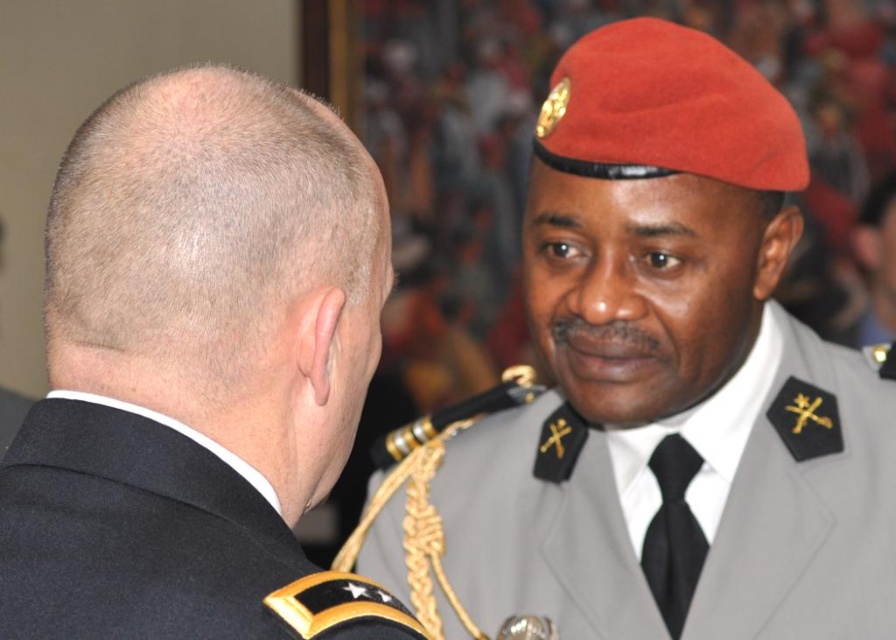
Question: Which point is farther to the camera?

Choices:
 (A) satin red beret at upper right
 (B) black matte uniform at left

Answer: (A)

Question: Can you confirm if black matte uniform at left is positioned above black wool military uniform at upper left?

Choices:
 (A) yes
 (B) no

Answer: (A)

Question: Does satin red beret at upper right have a smaller size compared to black matte uniform at left?

Choices:
 (A) no
 (B) yes

Answer: (A)

Question: Where is satin red beret at upper right located in relation to black matte uniform at left in the image?

Choices:
 (A) below
 (B) above

Answer: (B)

Question: Which of the following is the farthest from the observer?

Choices:
 (A) black matte uniform at left
 (B) black wool military uniform at upper left
 (C) satin red beret at upper right

Answer: (C)

Question: Among these points, which one is nearest to the camera?

Choices:
 (A) (321, 218)
 (B) (317, 621)

Answer: (B)